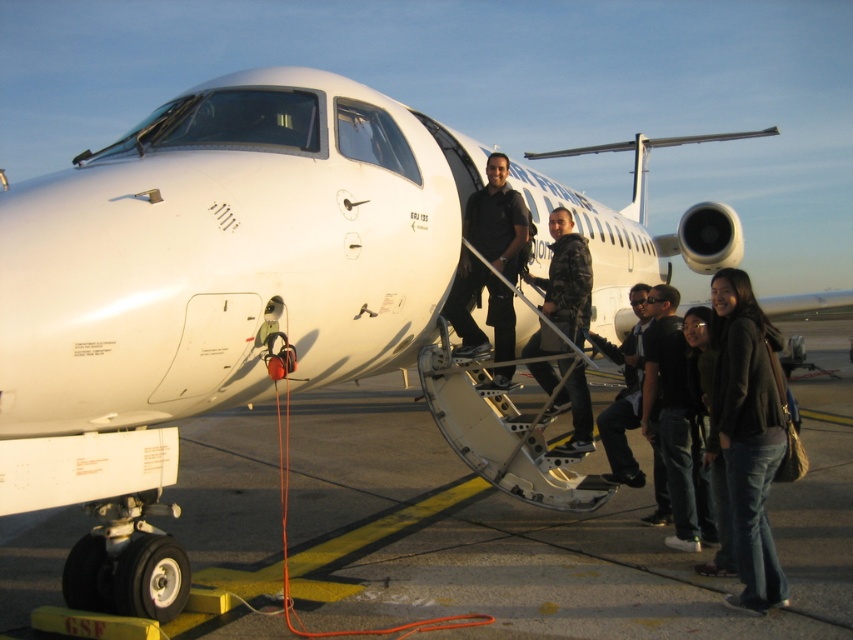
Which of these two, black matte uniform at center or dark blue jeans at center, stands taller?

black matte uniform at center

I want to click on black matte uniform at center, so click(x=498, y=220).

Locate an element on the screen. The height and width of the screenshot is (640, 853). black matte uniform at center is located at coordinates (498, 220).

This screenshot has height=640, width=853. Describe the element at coordinates (566, 276) in the screenshot. I see `camouflage jacket at center` at that location.

Who is lower down, camouflage jacket at center or dark blue jeans at center?

Positioned lower is dark blue jeans at center.

What do you see at coordinates (566, 276) in the screenshot?
I see `camouflage jacket at center` at bounding box center [566, 276].

You are a GUI agent. You are given a task and a screenshot of the screen. Output one action in this format:
    pyautogui.click(x=<x>, y=<y>)
    Task: Click on the camouflage jacket at center
    
    Given the screenshot: What is the action you would take?
    pyautogui.click(x=566, y=276)

Consider the image. Can you confirm if dark gray sweater at lower right is bigger than black matte uniform at center?

Incorrect, dark gray sweater at lower right is not larger than black matte uniform at center.

At what (x,y) coordinates should I click in order to perform the action: click on dark gray sweater at lower right. Please return your answer as a coordinate pair (x, y). This screenshot has width=853, height=640. Looking at the image, I should click on (747, 433).

Identify the location of dark gray sweater at lower right. [x=747, y=433].